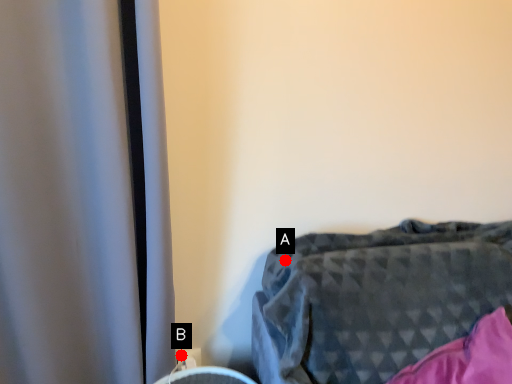
Question: Two points are circled on the image, labeled by A and B beside each circle. Which point is closer to the camera?

Choices:
 (A) A is closer
 (B) B is closer

Answer: (A)